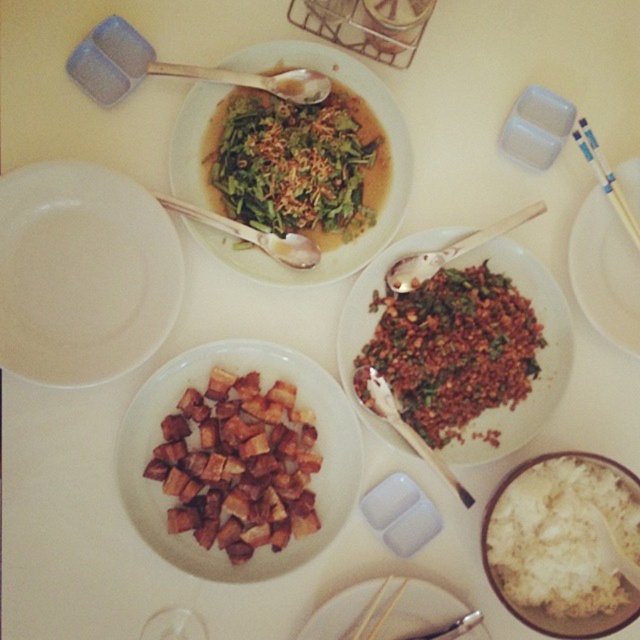
You are sitting at the table and want to reach the white matte plate at upper left. Based on its position, where exactly is it located on the table?

The white matte plate at upper left is located at point 0.428 on the x axis and 0.130 on the y axis.

You are a diner at the table and want to pick up the white plastic chopsticks at upper right to eat the dish on the white matte plate at upper left. Can you reach them without moving your hands from the plate?

The white matte plate at upper left is positioned on the left side of white plastic chopsticks at upper right, so the chopsticks are to the right of the plate. Since you can reach across, you can pick up the white plastic chopsticks at upper right to eat the dish on the white matte plate at upper left.